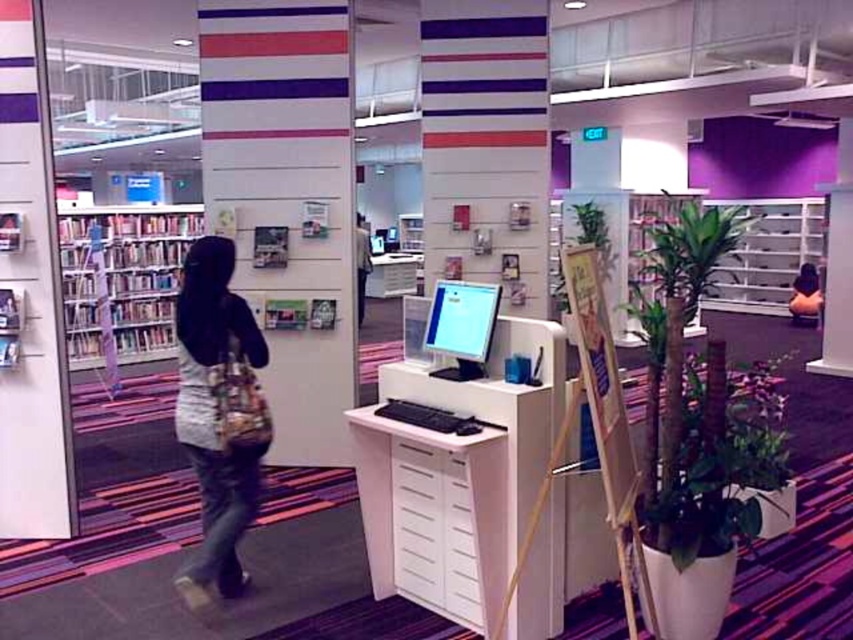
You are standing in the library and see two points marked on the wall. The first point is at coordinate point [225,244] and the second point is at coordinate point [538,499]. Which point is closer to you?

Point [225,244] is further to the camera than point [538,499], so the point closer to you is point [538,499].

You are standing at the entrance of the library and need to find the denim jeans at left. According to the coordinates provided, where should you look relative to your position?

The denim jeans at left is located at point coordinates, so you should look to the left side of the entrance area.

You are a customer in the library and want to place a new book on the widest object available. Which object should you choose between the denim jeans at left and the metallic silver bookshelf at right?

The metallic silver bookshelf at right is wider than the denim jeans at left, so you should place the new book on the metallic silver bookshelf at right.